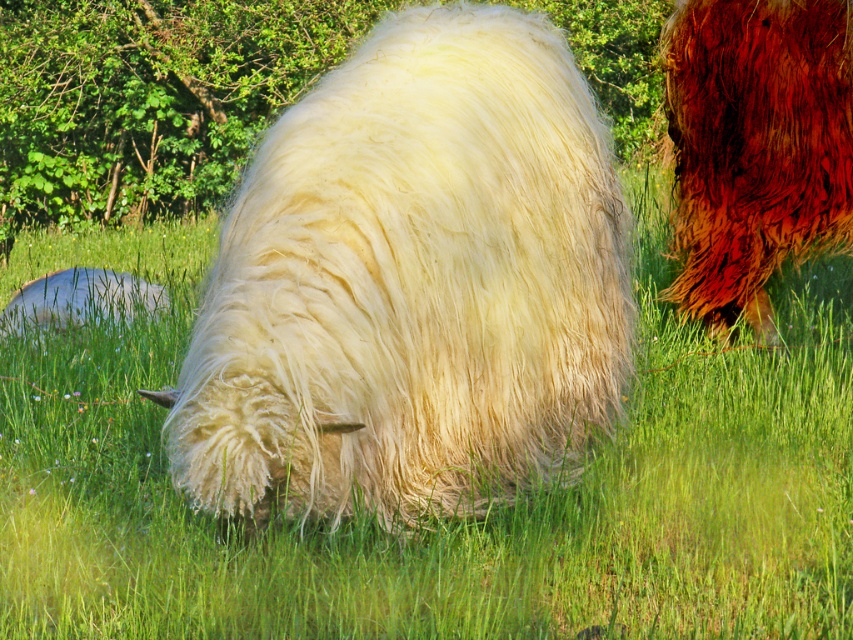
Question: Can you confirm if white woolly sheep at center is wider than shiny reddish-brown fur at upper right?

Choices:
 (A) yes
 (B) no

Answer: (B)

Question: In this image, where is white fluffy sheep at center located relative to shiny reddish-brown fur at upper right?

Choices:
 (A) right
 (B) left

Answer: (B)

Question: Based on their relative distances, which object is nearer to the white woolly sheep at center?

Choices:
 (A) shiny reddish-brown fur at upper right
 (B) white woolly sheep at lower left

Answer: (A)

Question: Among these objects, which one is nearest to the camera?

Choices:
 (A) white fluffy sheep at center
 (B) shiny reddish-brown fur at upper right

Answer: (A)

Question: Observing the image, what is the correct spatial positioning of white fluffy sheep at center in reference to white woolly sheep at lower left?

Choices:
 (A) below
 (B) above

Answer: (B)

Question: Which point is closer to the camera taking this photo?

Choices:
 (A) (733, 620)
 (B) (560, 316)

Answer: (A)